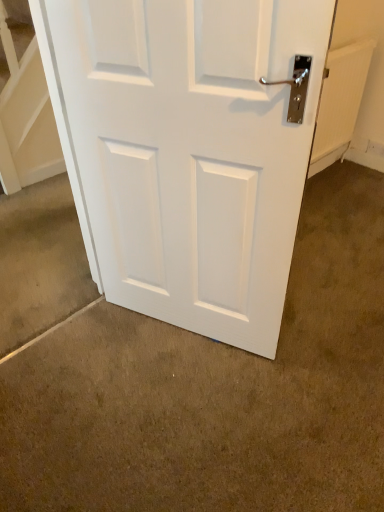
I want to click on vacant space underneath white matte door at center (from a real-world perspective), so click(x=192, y=333).